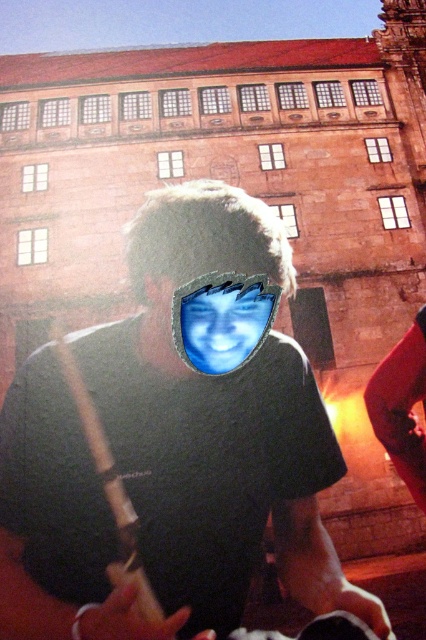
You are a photographer standing 10 meters away from the scene. You want to take a photo of the black matte shirt at center and blue matte face at center without any distortion caused by distance. Which object should you focus on first to ensure both are in sharp focus?

Since the black matte shirt at center is 12.89 meters away from the blue matte face at center, you should focus on the closer object. However, the exact distance of each object from you isn

You are an architect analyzing the image. You notice a point at coordinate (172, 449). What object is located at that point?

The black matte shirt at center is located at point (172, 449).

You are standing at the point closest to the camera in the image. Which of the two points, point [307,420] or point [265,296], is farther away from you?

Point [307,420] is behind point [265,296], so it is farther away from you.